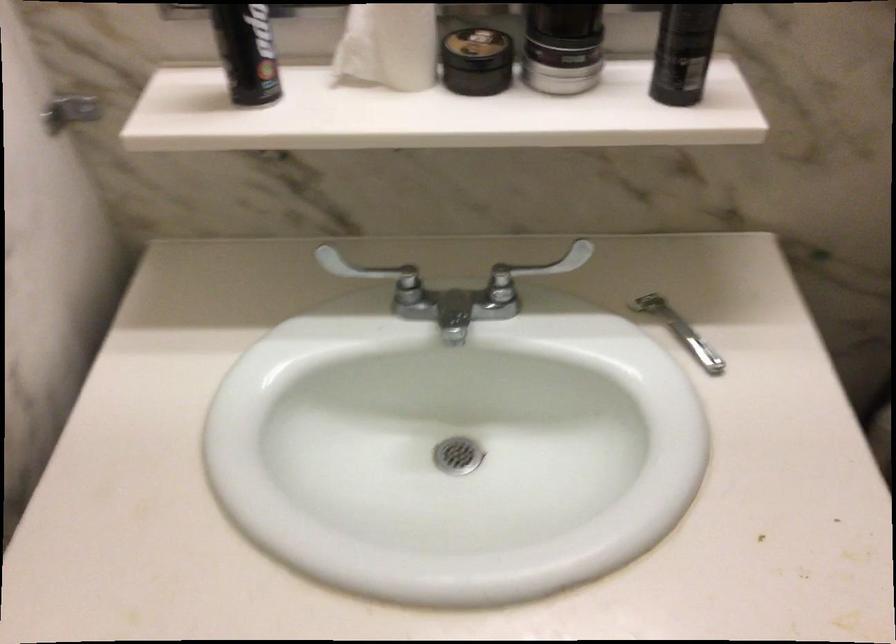
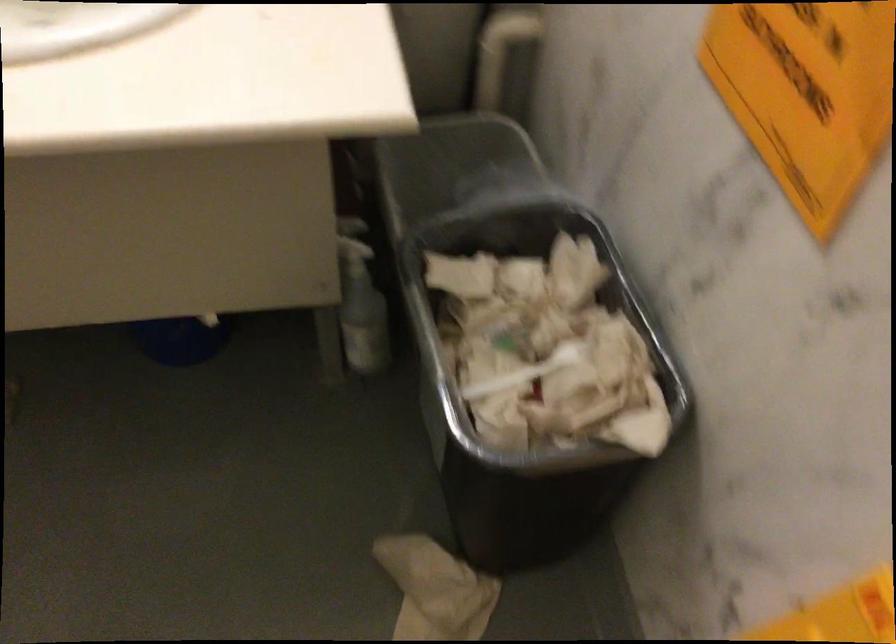
Question: The images are taken continuously from a first-person perspective. In which direction is your viewpoint rotating?

Choices:
 (A) Left
 (B) Right
 (C) Up
 (D) Down

Answer: (B)